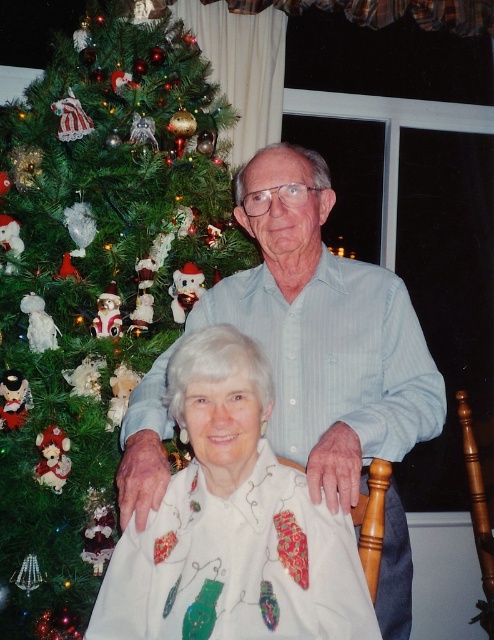
Question: Which point appears closest to the camera in this image?

Choices:
 (A) (175, 276)
 (B) (261, 618)

Answer: (B)

Question: Based on their relative distances, which object is farther from the light blue striped shirt at center?

Choices:
 (A) white satin blouse at center
 (B) green matte christmas tree at left

Answer: (B)

Question: From the image, what is the correct spatial relationship of green matte christmas tree at left in relation to white satin blouse at center?

Choices:
 (A) above
 (B) below

Answer: (A)

Question: Based on their relative distances, which object is nearer to the light blue striped shirt at center?

Choices:
 (A) white satin blouse at center
 (B) green matte christmas tree at left

Answer: (A)

Question: Can you confirm if green matte christmas tree at left is positioned below light blue striped shirt at center?

Choices:
 (A) no
 (B) yes

Answer: (A)

Question: Does green matte christmas tree at left have a greater width compared to light blue striped shirt at center?

Choices:
 (A) no
 (B) yes

Answer: (B)